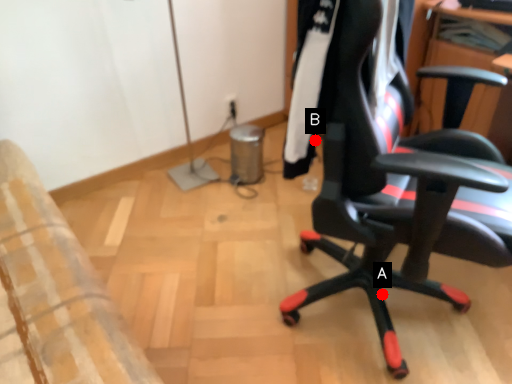
Question: Two points are circled on the image, labeled by A and B beside each circle. Which point is further to the camera?

Choices:
 (A) A is further
 (B) B is further

Answer: (A)